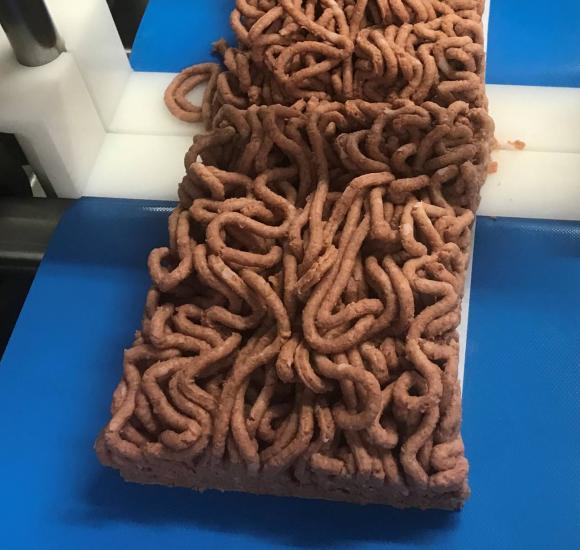
Find the location of a particular element. blue table is located at coordinates (177, 20), (532, 73), (522, 371), (28, 423).